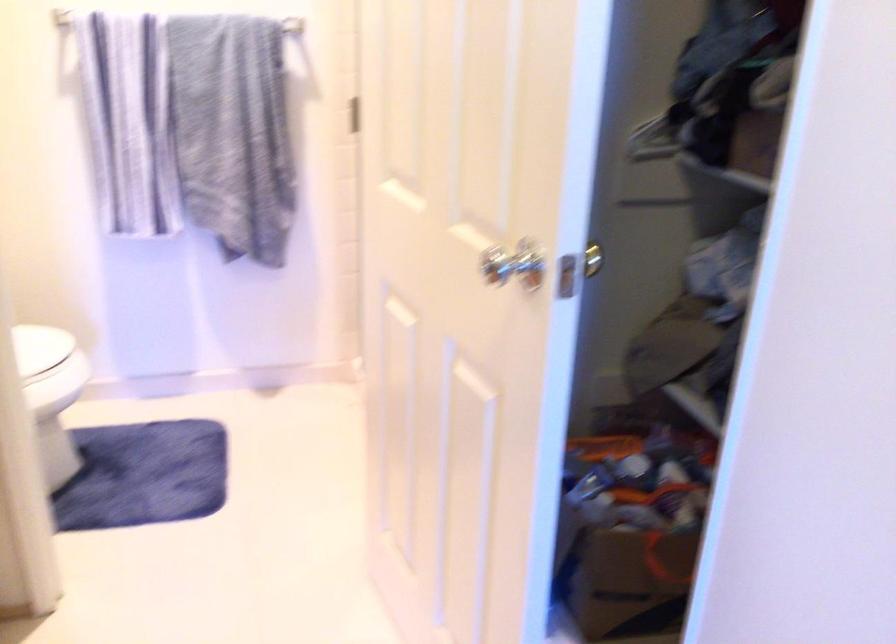
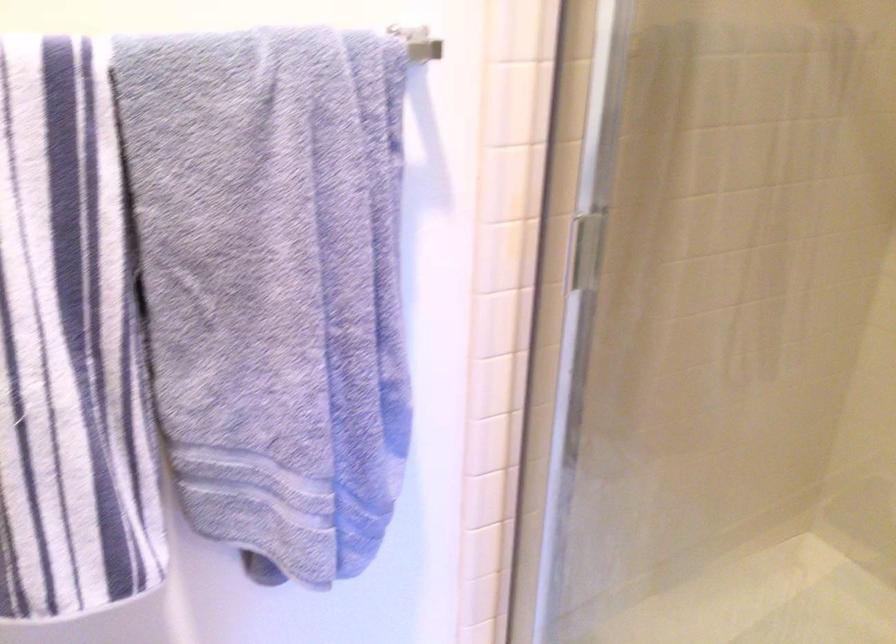
What movement of the cameraman would produce the second image?

The cameraman moved toward left, forward.